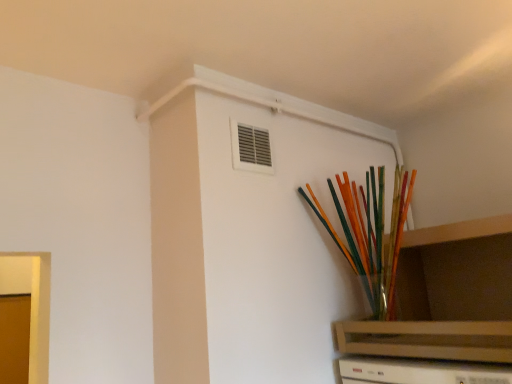
Question: Is clear glass vase at upper right wider or thinner than translucent glass vase at upper right?

Choices:
 (A) thin
 (B) wide

Answer: (B)

Question: Considering the positions of point (394, 326) and point (367, 256), is point (394, 326) closer or farther from the camera than point (367, 256)?

Choices:
 (A) closer
 (B) farther

Answer: (A)

Question: In the image, is clear glass vase at upper right positioned in front of or behind translucent glass vase at upper right?

Choices:
 (A) front
 (B) behind

Answer: (A)

Question: From the image's perspective, is translucent glass vase at upper right above or below clear glass vase at upper right?

Choices:
 (A) above
 (B) below

Answer: (A)

Question: From their relative heights in the image, would you say translucent glass vase at upper right is taller or shorter than clear glass vase at upper right?

Choices:
 (A) tall
 (B) short

Answer: (A)

Question: Does point tap(343, 193) appear closer or farther from the camera than point tap(433, 326)?

Choices:
 (A) closer
 (B) farther

Answer: (B)

Question: In the image, is translucent glass vase at upper right positioned in front of or behind clear glass vase at upper right?

Choices:
 (A) front
 (B) behind

Answer: (B)